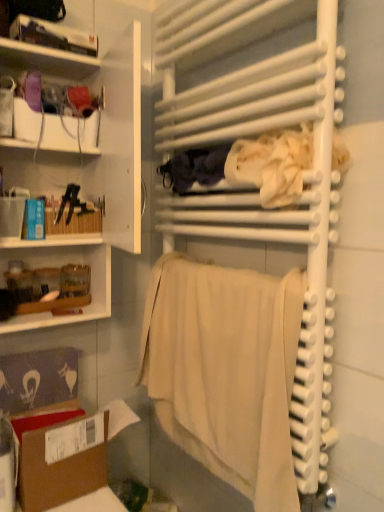
Question: Based on their sizes in the image, would you say dark blue fabric at center, the second clothing when ordered from right to left, is bigger or smaller than white glossy bookshelf at upper left, which ranks as the second shelf in bottom-to-top order?

Choices:
 (A) small
 (B) big

Answer: (B)

Question: Considering the positions of point (193, 151) and point (82, 51), is point (193, 151) closer or farther from the camera than point (82, 51)?

Choices:
 (A) farther
 (B) closer

Answer: (B)

Question: Which object is the closest to the white matte towel rack at center?

Choices:
 (A) brown cardboard box at lower left
 (B) white fabric at center, which ranks as the 2th clothing in left-to-right order
 (C) dark blue fabric at center, which appears as the 1th clothing when viewed from the left
 (D) matte white box at upper left
 (E) white matte cabinet at left, placed as the 1th shelf when sorted from bottom to top

Answer: (B)

Question: Estimate the real-world distances between objects in this image. Which object is farther from the white glossy bookshelf at upper left, the first shelf from the top?

Choices:
 (A) brown cardboard box at lower left
 (B) white matte towel rack at center
 (C) beige cotton towel at center
 (D) white matte cabinet at left, placed as the 1th shelf when sorted from bottom to top
 (E) white fabric at center, positioned as the first clothing in right-to-left order

Answer: (A)